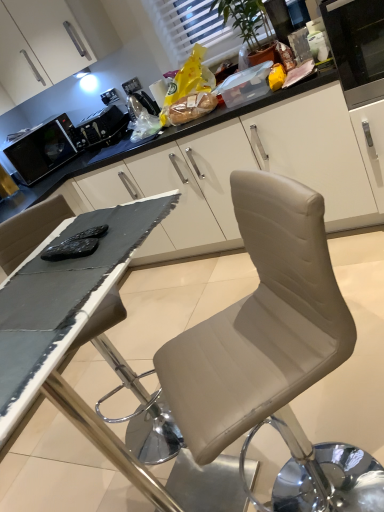
Question: Should I look upward or downward to see satin black toaster at upper center, the 1th appliance from the right?

Choices:
 (A) down
 (B) up

Answer: (B)

Question: Considering the relative sizes of matte plastic bag of bread at upper center and beige leather chair at center in the image provided, is matte plastic bag of bread at upper center taller than beige leather chair at center?

Choices:
 (A) yes
 (B) no

Answer: (A)

Question: Does matte plastic bag of bread at upper center have a greater width compared to beige leather chair at center?

Choices:
 (A) yes
 (B) no

Answer: (B)

Question: Is matte plastic bag of bread at upper center aimed at beige leather chair at center?

Choices:
 (A) yes
 (B) no

Answer: (B)

Question: Can you confirm if matte plastic bag of bread at upper center is positioned to the left of beige leather chair at center?

Choices:
 (A) yes
 (B) no

Answer: (A)

Question: Is the depth of matte plastic bag of bread at upper center greater than that of beige leather chair at center?

Choices:
 (A) yes
 (B) no

Answer: (A)

Question: Is matte plastic bag of bread at upper center to the right of beige leather chair at center from the viewer's perspective?

Choices:
 (A) no
 (B) yes

Answer: (A)

Question: Is white textured window at upper center positioned behind beige leather chair at center?

Choices:
 (A) yes
 (B) no

Answer: (A)

Question: Considering the relative positions of white textured window at upper center and beige leather chair at center in the image provided, is white textured window at upper center to the right of beige leather chair at center from the viewer's perspective?

Choices:
 (A) no
 (B) yes

Answer: (B)

Question: Would you say white textured window at upper center is outside beige leather chair at center?

Choices:
 (A) yes
 (B) no

Answer: (A)

Question: Does white textured window at upper center appear on the left side of beige leather chair at center?

Choices:
 (A) no
 (B) yes

Answer: (A)

Question: Is white textured window at upper center not near beige leather chair at center?

Choices:
 (A) yes
 (B) no

Answer: (A)

Question: Is the position of white textured window at upper center less distant than that of beige leather chair at center?

Choices:
 (A) no
 (B) yes

Answer: (A)

Question: Is satin black toaster at upper center, the 1th appliance from the right, turned away from black matte table at center?

Choices:
 (A) no
 (B) yes

Answer: (A)